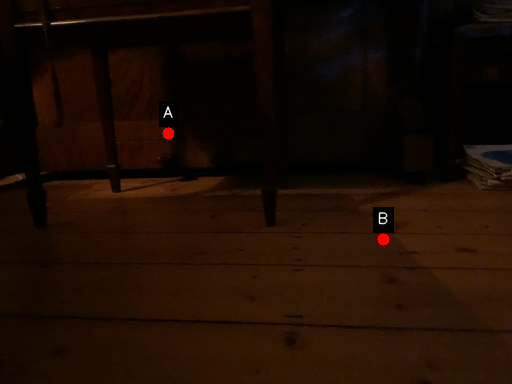
Question: Two points are circled on the image, labeled by A and B beside each circle. Which point is closer to the camera?

Choices:
 (A) A is closer
 (B) B is closer

Answer: (B)